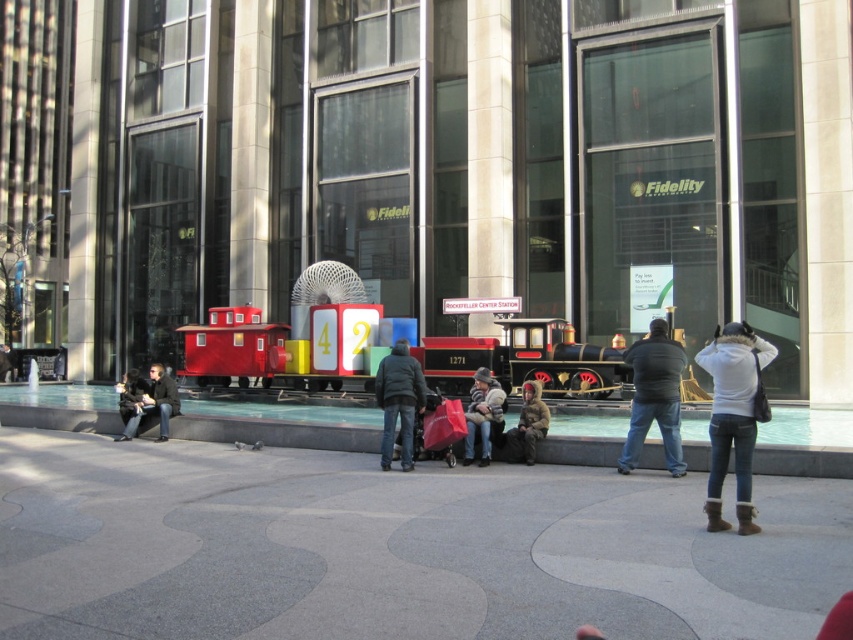
You are a visitor at the event and want to take a photo of the matte red train at center without the black matte jacket at center blocking the view. Is the jacket likely to block the view of the train?

The matte red train at center is taller than the black matte jacket at center, so the jacket is shorter and less likely to block the view of the train.